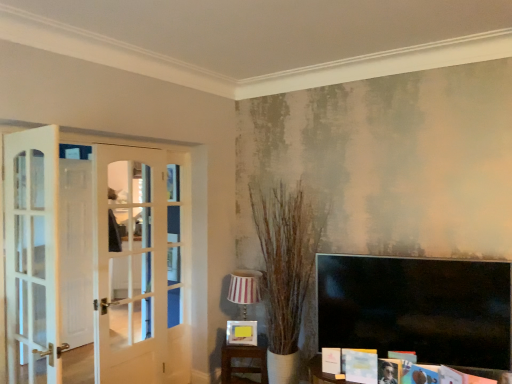
Question: Is matte yellow picture frame at center at the left side of wooden table at lower center?

Choices:
 (A) no
 (B) yes

Answer: (B)

Question: Is wooden table at lower center at the back of matte yellow picture frame at center?

Choices:
 (A) no
 (B) yes

Answer: (A)

Question: Is matte yellow picture frame at center not near wooden table at lower center?

Choices:
 (A) no
 (B) yes

Answer: (A)

Question: Can you confirm if matte yellow picture frame at center is shorter than wooden table at lower center?

Choices:
 (A) yes
 (B) no

Answer: (A)

Question: From a real-world perspective, is matte yellow picture frame at center located beneath wooden table at lower center?

Choices:
 (A) yes
 (B) no

Answer: (B)

Question: Is matte yellow picture frame at center taller than wooden table at lower center?

Choices:
 (A) yes
 (B) no

Answer: (B)

Question: Can you confirm if matte yellow picture frame at center is wider than matte white magazine at lower right?

Choices:
 (A) yes
 (B) no

Answer: (A)

Question: Can we say matte yellow picture frame at center lies outside matte white magazine at lower right?

Choices:
 (A) yes
 (B) no

Answer: (A)

Question: Does matte yellow picture frame at center lie in front of matte white magazine at lower right?

Choices:
 (A) yes
 (B) no

Answer: (B)

Question: Could matte white magazine at lower right be considered to be inside matte yellow picture frame at center?

Choices:
 (A) no
 (B) yes

Answer: (A)

Question: Is matte yellow picture frame at center next to matte white magazine at lower right and touching it?

Choices:
 (A) yes
 (B) no

Answer: (B)

Question: Can you confirm if matte yellow picture frame at center is taller than matte white magazine at lower right?

Choices:
 (A) no
 (B) yes

Answer: (B)

Question: From a real-world perspective, is wooden table at lower center positioned under striped fabric lampshade at center based on gravity?

Choices:
 (A) no
 (B) yes

Answer: (B)